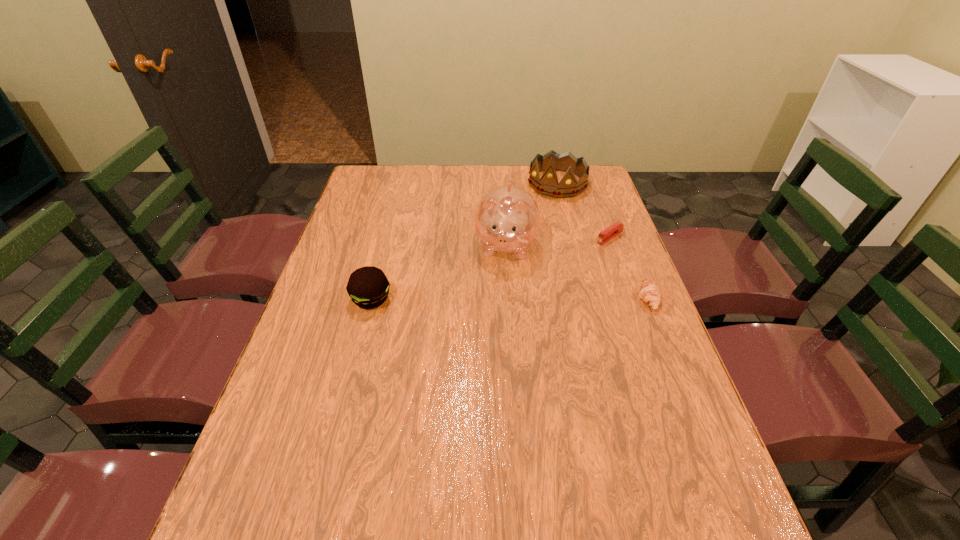
Locate an element on the screen. This screenshot has height=540, width=960. object present at the far edge is located at coordinates (548, 185).

You are a GUI agent. You are given a task and a screenshot of the screen. Output one action in this format:
    pyautogui.click(x=<x>, y=<y>)
    Task: Click on the object located at the left edge
    The width and height of the screenshot is (960, 540).
    Given the screenshot: What is the action you would take?
    pyautogui.click(x=368, y=287)

At what (x,y) coordinates should I click in order to perform the action: click on pastry located at the right edge. Please return your answer as a coordinate pair (x, y). This screenshot has height=540, width=960. Looking at the image, I should click on (649, 292).

Identify the location of stapler at the right edge. (616, 228).

The height and width of the screenshot is (540, 960). What are the coordinates of `tiara present at the right edge` in the screenshot? It's located at (548, 185).

The image size is (960, 540). Find the location of `object situated at the far right corner`. object situated at the far right corner is located at coordinates (548, 185).

Where is `free space at the far edge of the desktop`? The height and width of the screenshot is (540, 960). free space at the far edge of the desktop is located at coordinates (528, 189).

Image resolution: width=960 pixels, height=540 pixels. Find the location of `vacant space at the near edge of the desktop`. vacant space at the near edge of the desktop is located at coordinates (543, 463).

Image resolution: width=960 pixels, height=540 pixels. Identify the location of vacant position at the left edge of the desktop. (349, 205).

I want to click on free space at the right edge of the desktop, so click(x=614, y=260).